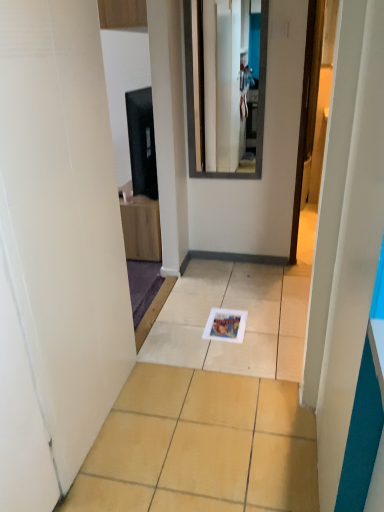
Describe the element at coordinates (142, 142) in the screenshot. I see `matte black tv at upper left` at that location.

Identify the location of smooth glass mirror at upper center. This screenshot has width=384, height=512. (227, 80).

This screenshot has width=384, height=512. Describe the element at coordinates (200, 446) in the screenshot. I see `white glossy tile at center` at that location.

Identify the location of matte black tv at upper left. (142, 142).

From a real-world perspective, between white glossy tile at center and smooth glass mirror at upper center, who is vertically higher?

smooth glass mirror at upper center, from a real-world perspective.

From the image's perspective, which object appears higher, white glossy tile at center or smooth glass mirror at upper center?

smooth glass mirror at upper center appears higher in the image.

Is white glossy tile at center looking in the opposite direction of smooth glass mirror at upper center?

white glossy tile at center does not have its back to smooth glass mirror at upper center.

Can you confirm if white glossy tile at center is bigger than smooth glass mirror at upper center?

Yes, white glossy tile at center is bigger than smooth glass mirror at upper center.

Considering the points (257, 14) and (127, 119), which point is behind, point (257, 14) or point (127, 119)?

The point (127, 119) is more distant.

How many degrees apart are the facing directions of smooth glass mirror at upper center and matte black tv at upper left?

smooth glass mirror at upper center and matte black tv at upper left are facing 90 degrees away from each other.

Can you confirm if smooth glass mirror at upper center is thinner than matte black tv at upper left?

Indeed, smooth glass mirror at upper center has a lesser width compared to matte black tv at upper left.

Is smooth glass mirror at upper center at the right side of matte black tv at upper left?

Yes.

Can you confirm if smooth glass mirror at upper center is positioned to the right of white glossy tile at center?

Indeed, smooth glass mirror at upper center is positioned on the right side of white glossy tile at center.

Which point is more distant from viewer, (229, 97) or (292, 510)?

The point (229, 97) is farther.

Considering the positions of point (143, 163) and point (120, 442), is point (143, 163) closer or farther from the camera than point (120, 442)?

Point (143, 163) appears to be farther away from the viewer than point (120, 442).

What's the angular difference between matte black tv at upper left and white glossy tile at center's facing directions?

They differ by 89.3 degrees in their facing directions.

Is white glossy tile at center surrounded by matte black tv at upper left?

Actually, white glossy tile at center is outside matte black tv at upper left.

From a real-world perspective, is matte black tv at upper left located beneath white glossy tile at center?

No, from a real-world perspective, matte black tv at upper left is not under white glossy tile at center.

Considering the relative sizes of matte black tv at upper left and smooth glass mirror at upper center in the image provided, is matte black tv at upper left smaller than smooth glass mirror at upper center?

Actually, matte black tv at upper left might be larger than smooth glass mirror at upper center.

From the image's perspective, which object appears higher, matte black tv at upper left or smooth glass mirror at upper center?

smooth glass mirror at upper center appears higher in the image.

From the picture: How different are the orientations of matte black tv at upper left and smooth glass mirror at upper center in degrees?

90 degrees separate the facing orientations of matte black tv at upper left and smooth glass mirror at upper center.

Between white glossy tile at center and matte black tv at upper left, which one has larger width?

white glossy tile at center.

Is white glossy tile at center turned away from matte black tv at upper left?

No.

Find the location of a particular element. This screenshot has height=512, width=384. appliance on the left of white glossy tile at center is located at coordinates (142, 142).

Locate an element on the screen. ceramic tile below the smooth glass mirror at upper center (from the image's perspective) is located at coordinates (200, 446).

Find the location of `mirror on the right of matte black tv at upper left`. mirror on the right of matte black tv at upper left is located at coordinates (227, 80).

Estimate the real-world distances between objects in this image. Which object is closer to matte black tv at upper left, white glossy tile at center or smooth glass mirror at upper center?

smooth glass mirror at upper center is positioned closer to the anchor matte black tv at upper left.

From the picture: From the image, which object appears to be nearer to matte black tv at upper left, smooth glass mirror at upper center or white glossy tile at center?

Based on the image, smooth glass mirror at upper center appears to be nearer to matte black tv at upper left.

From the image, which object appears to be nearer to white glossy tile at center, smooth glass mirror at upper center or matte black tv at upper left?

Among the two, matte black tv at upper left is located nearer to white glossy tile at center.

When comparing their distances from smooth glass mirror at upper center, does matte black tv at upper left or white glossy tile at center seem further?

white glossy tile at center lies further to smooth glass mirror at upper center than the other object.

Based on their spatial positions, is white glossy tile at center or matte black tv at upper left closer to smooth glass mirror at upper center?

matte black tv at upper left.

From the image, which object appears to be nearer to white glossy tile at center, matte black tv at upper left or smooth glass mirror at upper center?

matte black tv at upper left is positioned closer to the anchor white glossy tile at center.

I want to click on appliance between smooth glass mirror at upper center and white glossy tile at center in the up-down direction, so click(142, 142).